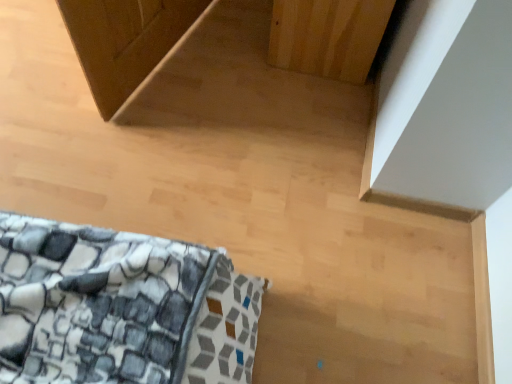
You are a GUI agent. You are given a task and a screenshot of the screen. Output one action in this format:
    pyautogui.click(x=<x>, y=<y>)
    Task: Click on the vacant area in front of natural wood cabinet at upper center
    Image resolution: width=512 pixels, height=384 pixels.
    Given the screenshot: What is the action you would take?
    pyautogui.click(x=301, y=104)